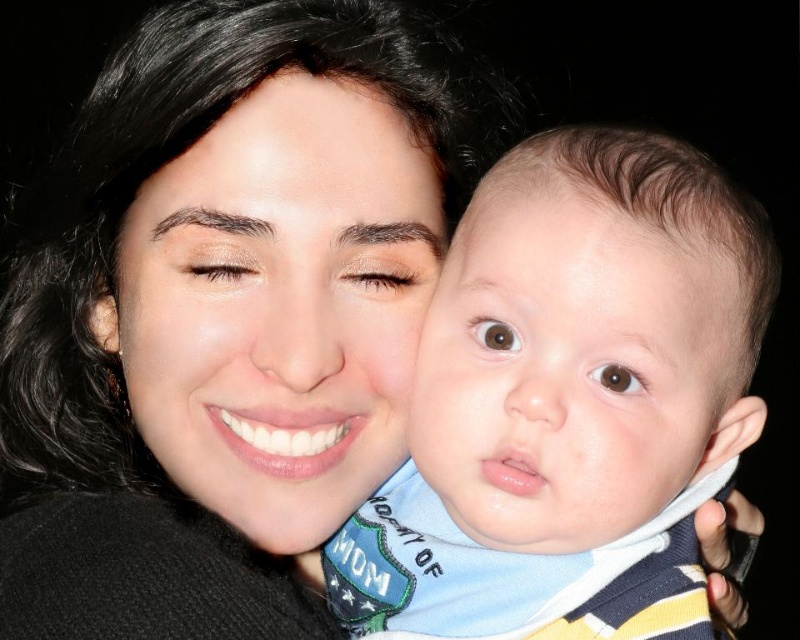
Does smooth skin face at center have a lesser width compared to smooth skin baby at center?

In fact, smooth skin face at center might be wider than smooth skin baby at center.

Describe the element at coordinates (278, 305) in the screenshot. I see `smooth skin face at center` at that location.

The width and height of the screenshot is (800, 640). I want to click on smooth skin face at center, so click(278, 305).

Does soft blue bib at center have a lesser height compared to smooth skin baby at center?

No.

Between point (582, 336) and point (684, 474), which one is positioned behind?

Point (684, 474)

Where is `soft blue bib at center`? This screenshot has width=800, height=640. soft blue bib at center is located at coordinates (570, 403).

Does soft blue bib at center have a greater height compared to smooth skin face at center?

Indeed, soft blue bib at center has a greater height compared to smooth skin face at center.

Does soft blue bib at center appear under smooth skin face at center?

Correct, soft blue bib at center is located below smooth skin face at center.

Is point (460, 573) farther from viewer compared to point (290, 252)?

Yes, it is.

What are the coordinates of `soft blue bib at center` in the screenshot? It's located at (570, 403).